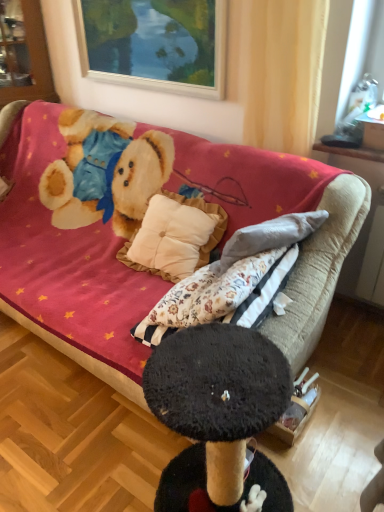
The width and height of the screenshot is (384, 512). I want to click on velvet beige couch at center, so click(x=320, y=270).

Locate an element on the screen. This screenshot has width=384, height=512. yellow sheer curtain at upper center is located at coordinates (281, 71).

Is brushed metal cabinet at upper left facing away from yellow sheer curtain at upper center?

No, brushed metal cabinet at upper left is not facing the opposite direction of yellow sheer curtain at upper center.

From the image's perspective, which is below, brushed metal cabinet at upper left or yellow sheer curtain at upper center?

yellow sheer curtain at upper center appears lower in the image.

Is brushed metal cabinet at upper left wider or thinner than yellow sheer curtain at upper center?

brushed metal cabinet at upper left is wider than yellow sheer curtain at upper center.

Considering the positions of objects brushed metal cabinet at upper left and yellow sheer curtain at upper center in the image provided, who is behind, brushed metal cabinet at upper left or yellow sheer curtain at upper center?

brushed metal cabinet at upper left is more distant.

Who is more distant, velvet beige couch at center or yellow sheer curtain at upper center?

Positioned behind is yellow sheer curtain at upper center.

Can you confirm if velvet beige couch at center is shorter than yellow sheer curtain at upper center?

No, velvet beige couch at center is not shorter than yellow sheer curtain at upper center.

From the image's perspective, is velvet beige couch at center located above or below yellow sheer curtain at upper center?

Clearly, from the image's perspective, velvet beige couch at center is below yellow sheer curtain at upper center.

From a real-world perspective, between velvet beige couch at center and yellow sheer curtain at upper center, who is vertically higher?

From a 3D spatial view, yellow sheer curtain at upper center is above.

From a real-world perspective, is wooden picture frame at upper center physically located above or below velvet beige couch at center?

From a real-world perspective, wooden picture frame at upper center is physically above velvet beige couch at center.

From the image's perspective, is wooden picture frame at upper center on top of velvet beige couch at center?

Yes, from the image's perspective, wooden picture frame at upper center is above velvet beige couch at center.

From the picture: Is there a large distance between wooden picture frame at upper center and velvet beige couch at center?

Indeed, wooden picture frame at upper center is not near velvet beige couch at center.

Is wooden picture frame at upper center positioned before velvet beige couch at center?

No.

Could you tell me if yellow sheer curtain at upper center is turned towards wooden picture frame at upper center?

No, yellow sheer curtain at upper center is not oriented towards wooden picture frame at upper center.

Is yellow sheer curtain at upper center far from wooden picture frame at upper center?

yellow sheer curtain at upper center is actually quite close to wooden picture frame at upper center.

From a real-world perspective, which is physically above, yellow sheer curtain at upper center or wooden picture frame at upper center?

wooden picture frame at upper center.

From the image's perspective, between yellow sheer curtain at upper center and wooden picture frame at upper center, who is located below?

yellow sheer curtain at upper center appears lower in the image.

Which is further, (311, 26) or (49, 94)?

The point (49, 94) is behind.

Is yellow sheer curtain at upper center further to the viewer compared to brushed metal cabinet at upper left?

No, yellow sheer curtain at upper center is closer to the viewer.

Is yellow sheer curtain at upper center taller or shorter than brushed metal cabinet at upper left?

Clearly, yellow sheer curtain at upper center is shorter compared to brushed metal cabinet at upper left.

Between brushed metal cabinet at upper left and wooden picture frame at upper center, which one has smaller size?

wooden picture frame at upper center.

Is brushed metal cabinet at upper left closer to the viewer compared to wooden picture frame at upper center?

No, brushed metal cabinet at upper left is further to the viewer.

Based on the photo, from the image's perspective, is brushed metal cabinet at upper left over wooden picture frame at upper center?

Indeed, from the image's perspective, brushed metal cabinet at upper left is shown above wooden picture frame at upper center.

Would you say brushed metal cabinet at upper left is a long distance from wooden picture frame at upper center?

No, brushed metal cabinet at upper left is in close proximity to wooden picture frame at upper center.

Looking at this image, is wooden picture frame at upper center to the left of brushed metal cabinet at upper left from the viewer's perspective?

No, wooden picture frame at upper center is not to the left of brushed metal cabinet at upper left.

Is wooden picture frame at upper center facing away from brushed metal cabinet at upper left?

No.

Is wooden picture frame at upper center next to brushed metal cabinet at upper left and touching it?

There is a gap between wooden picture frame at upper center and brushed metal cabinet at upper left.

Choose the correct answer: Is wooden picture frame at upper center inside brushed metal cabinet at upper left or outside it?

wooden picture frame at upper center is not enclosed by brushed metal cabinet at upper left.

Find the location of a particular element. The height and width of the screenshot is (512, 384). curtain that appears below the brushed metal cabinet at upper left (from the image's perspective) is located at coordinates (281, 71).

I want to click on curtain that appears behind the velvet beige couch at center, so click(x=281, y=71).

Looking at the image, which one is located closer to yellow sheer curtain at upper center, velvet beige couch at center or wooden picture frame at upper center?

wooden picture frame at upper center is closer to yellow sheer curtain at upper center.

Estimate the real-world distances between objects in this image. Which object is closer to yellow sheer curtain at upper center, wooden picture frame at upper center or brushed metal cabinet at upper left?

Among the two, wooden picture frame at upper center is located nearer to yellow sheer curtain at upper center.

Which object lies further to the anchor point wooden picture frame at upper center, yellow sheer curtain at upper center or brushed metal cabinet at upper left?

Among the two, brushed metal cabinet at upper left is located further to wooden picture frame at upper center.

Estimate the real-world distances between objects in this image. Which object is further from velvet beige couch at center, yellow sheer curtain at upper center or brushed metal cabinet at upper left?

Based on the image, brushed metal cabinet at upper left appears to be further to velvet beige couch at center.

From the image, which object appears to be nearer to velvet beige couch at center, wooden picture frame at upper center or brushed metal cabinet at upper left?

wooden picture frame at upper center is closer to velvet beige couch at center.

Which object lies further to the anchor point wooden picture frame at upper center, yellow sheer curtain at upper center or velvet beige couch at center?

Among the two, velvet beige couch at center is located further to wooden picture frame at upper center.

Considering their positions, is velvet beige couch at center positioned closer to brushed metal cabinet at upper left than yellow sheer curtain at upper center?

The object closer to brushed metal cabinet at upper left is yellow sheer curtain at upper center.

Based on their spatial positions, is brushed metal cabinet at upper left or velvet beige couch at center further from yellow sheer curtain at upper center?

brushed metal cabinet at upper left is positioned further to the anchor yellow sheer curtain at upper center.

Where is `picture frame positioned between velvet beige couch at center and brushed metal cabinet at upper left from near to far`? The height and width of the screenshot is (512, 384). picture frame positioned between velvet beige couch at center and brushed metal cabinet at upper left from near to far is located at coordinates (155, 42).

You are a GUI agent. You are given a task and a screenshot of the screen. Output one action in this format:
    pyautogui.click(x=<x>, y=<y>)
    Task: Click on the picture frame located between brushed metal cabinet at upper left and yellow sheer curtain at upper center in the left-right direction
    This screenshot has width=384, height=512.
    Given the screenshot: What is the action you would take?
    pyautogui.click(x=155, y=42)

Where is `studio couch between brushed metal cabinet at upper left and yellow sheer curtain at upper center from left to right`? Image resolution: width=384 pixels, height=512 pixels. studio couch between brushed metal cabinet at upper left and yellow sheer curtain at upper center from left to right is located at coordinates (320, 270).

The image size is (384, 512). What are the coordinates of `curtain between velvet beige couch at center and wooden picture frame at upper center along the z-axis` in the screenshot? It's located at [x=281, y=71].